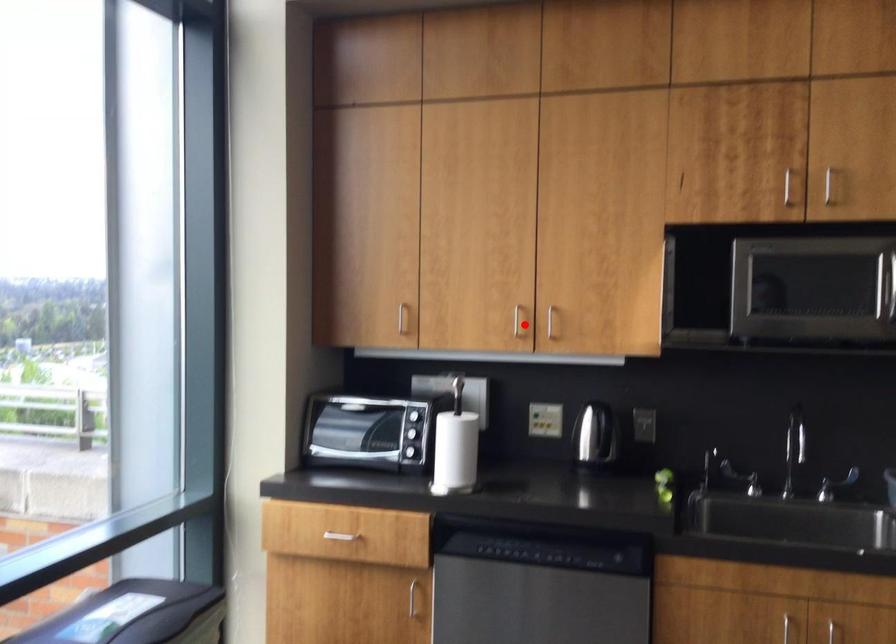
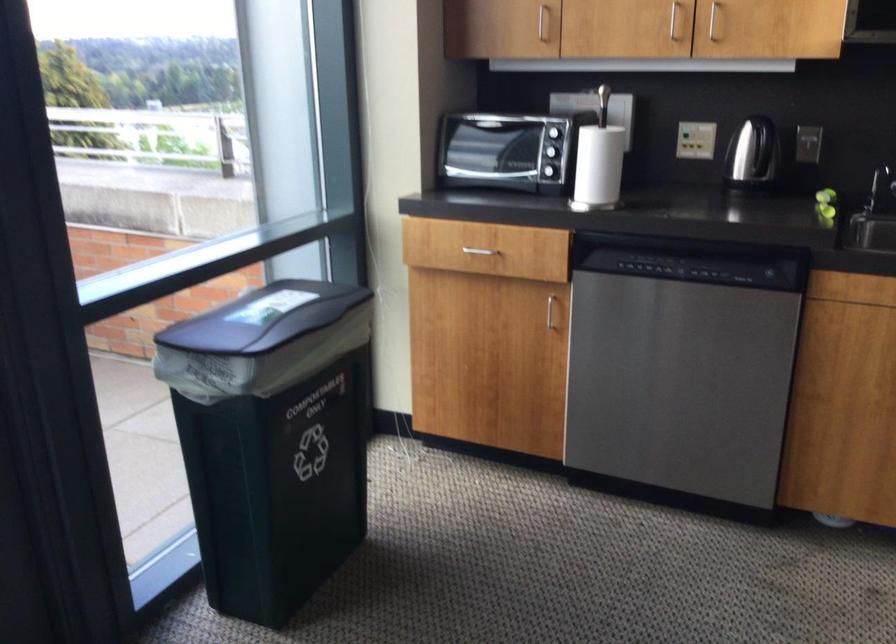
Find the pixel in the second image that matches the highlighted location in the first image.

(673, 20)